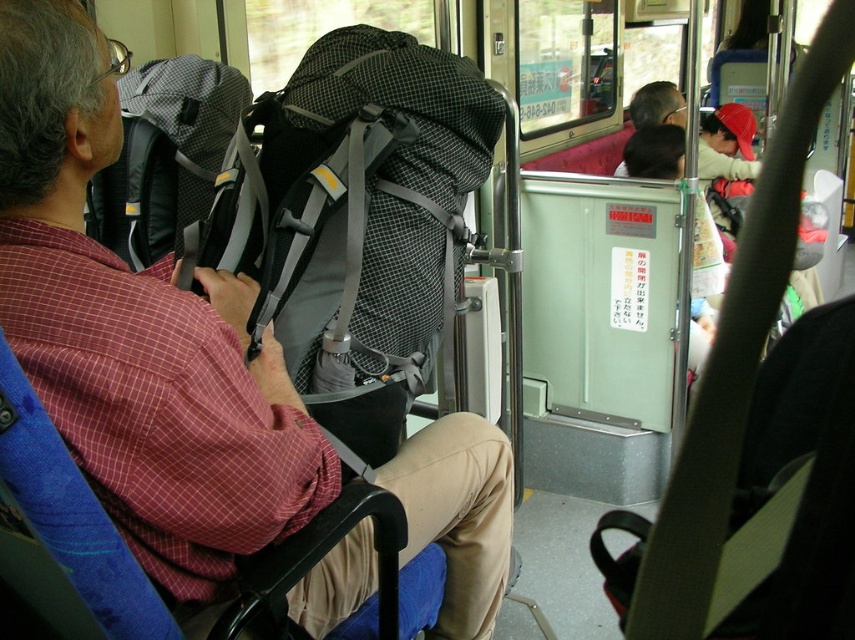
Does matte black backpack at center have a greater width compared to gray mesh backpack at left?

Yes.

In the scene shown: Between matte black backpack at center and gray mesh backpack at left, which one appears on the right side from the viewer's perspective?

matte black backpack at center

The width and height of the screenshot is (855, 640). I want to click on matte black backpack at center, so click(x=137, y=333).